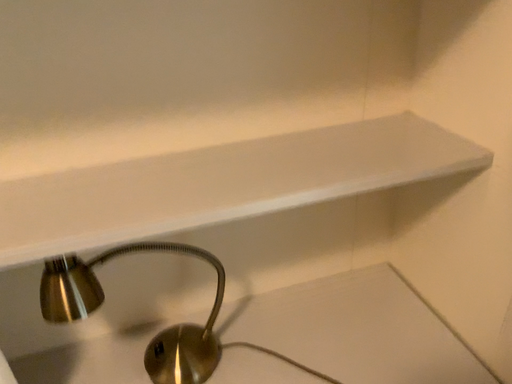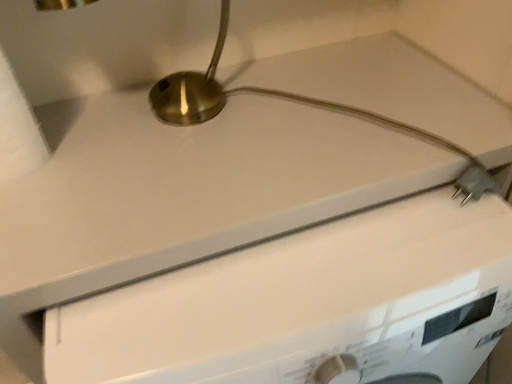
Question: How did the camera likely rotate when shooting the video?

Choices:
 (A) rotated downward
 (B) rotated upward

Answer: (A)